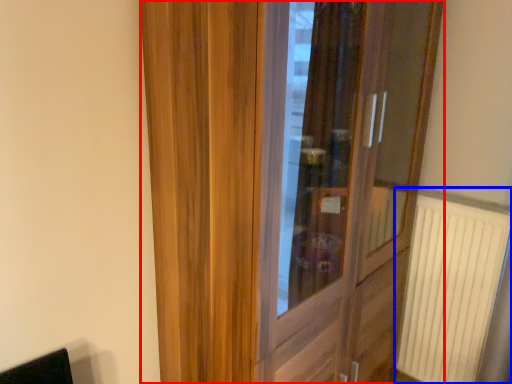
Question: Among these objects, which one is nearest to the camera, door (highlighted by a red box) or radiator (highlighted by a blue box)?

Choices:
 (A) door
 (B) radiator

Answer: (A)